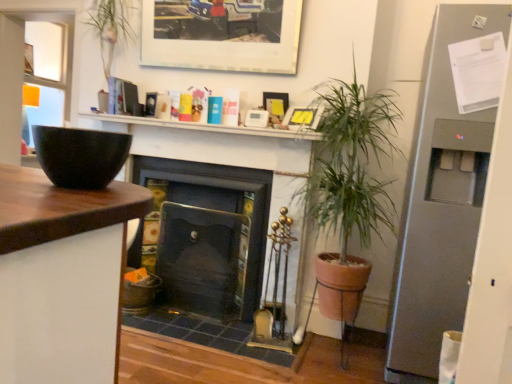
Question: Which is correct: green leafy plant at center is inside yellow paper picture frame at upper center, arranged as the 3th picture frame when viewed from the top, or outside of it?

Choices:
 (A) inside
 (B) outside

Answer: (B)

Question: Considering the positions of point (353, 180) and point (315, 107), is point (353, 180) closer or farther from the camera than point (315, 107)?

Choices:
 (A) farther
 (B) closer

Answer: (B)

Question: Which object is the farthest from the matte yellow picture frame at upper center, which is counted as the 2th picture frame, starting from the bottom?

Choices:
 (A) dark gray stone fireplace at center, arranged as the second fireplace when viewed from the left
 (B) matte black fireplace at center, the 2th fireplace viewed from the right
 (C) yellow paper picture frame at upper center, arranged as the 3th picture frame when viewed from the top
 (D) satin silver fridge at right
 (E) matte black bowl at left

Answer: (E)

Question: Which of these objects is positioned closest to the dark gray stone fireplace at center, arranged as the second fireplace when viewed from the left?

Choices:
 (A) green leafy plant at center
 (B) matte yellow picture frame at upper center, which is counted as the 2th picture frame, starting from the bottom
 (C) matte white picture frame at upper center, which is counted as the 1th picture frame, starting from the top
 (D) white matte shelf at upper center
 (E) satin silver fridge at right

Answer: (A)